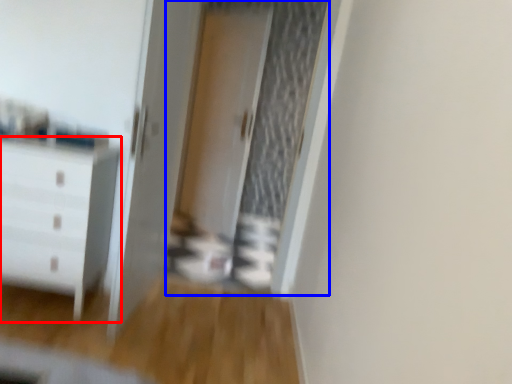
Question: Which object is closer to the camera taking this photo, chest of drawers (highlighted by a red box) or screen door (highlighted by a blue box)?

Choices:
 (A) chest of drawers
 (B) screen door

Answer: (A)